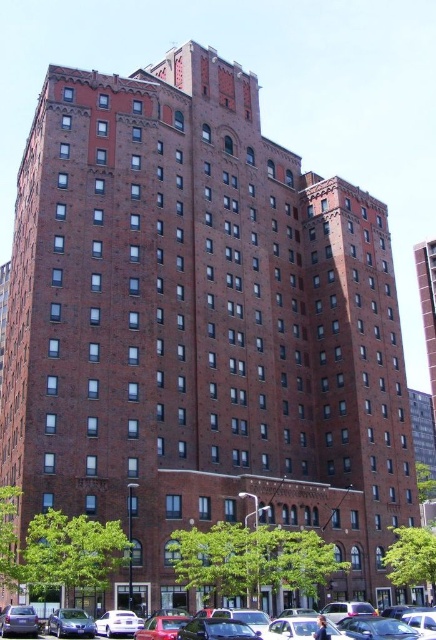
Is point (55, 616) less distant than point (24, 621)?

That is False.

Does point (94, 634) lie behind point (27, 625)?

Yes, point (94, 634) is farther from viewer.

Locate an element on the screen. metallic blue sedan at lower left is located at coordinates (71, 624).

Find the location of `matte red car at center`. matte red car at center is located at coordinates (88, 625).

Consider the image. Can you confirm if matte red car at center is positioned above metallic blue sedan at lower left?

Incorrect, matte red car at center is not positioned above metallic blue sedan at lower left.

In order to click on matte red car at center in this screenshot , I will do `click(88, 625)`.

Is matte red car at center thinner than matte blue sedan at lower left?

In fact, matte red car at center might be wider than matte blue sedan at lower left.

Find the location of a particular element. This screenshot has width=436, height=640. matte red car at center is located at coordinates (88, 625).

The height and width of the screenshot is (640, 436). What are the coordinates of `matte red car at center` in the screenshot? It's located at (88, 625).